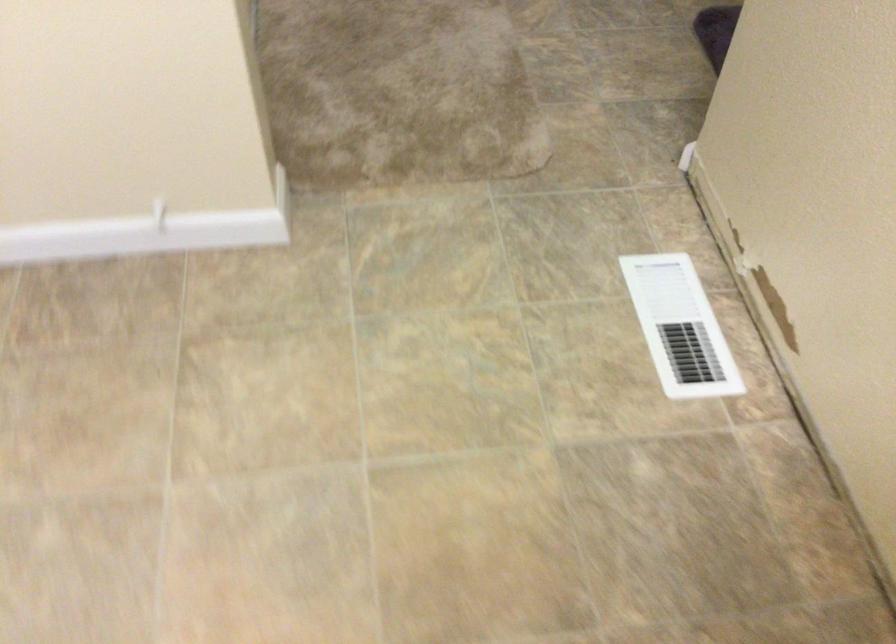
Identify the location of white floor vent. The image size is (896, 644). (679, 327).